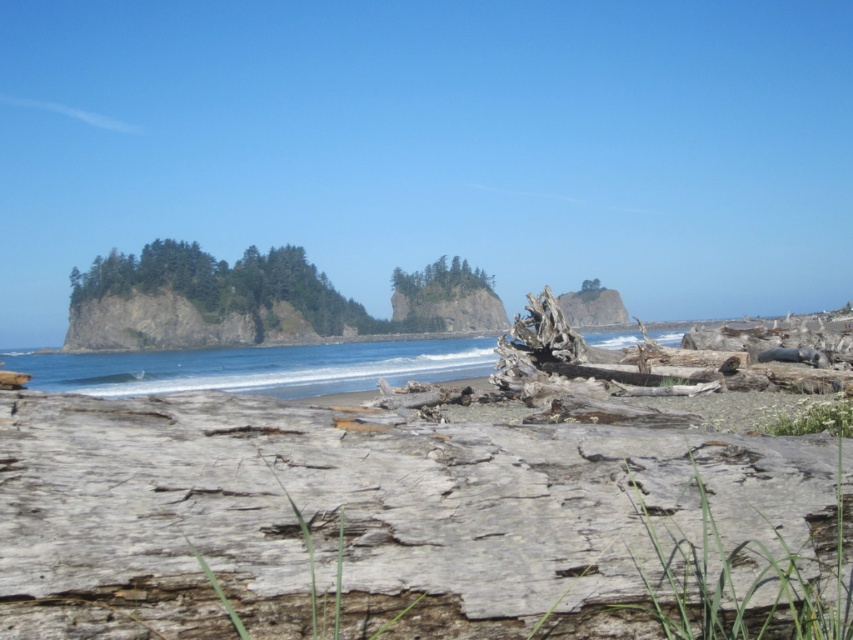
You are standing on the beach looking at the coastal landscape. There are two points marked in the scene, one at coordinates point (x=181, y=321) and the other at point (x=405, y=272). Which point is nearer to you?

Point (x=181, y=321) is closer to the viewer than point (x=405, y=272).

You are standing on the beach and want to take a photo of both the green rough rock island at left and the green textured trees at center. Which object should you zoom in on first to ensure both fit in the frame?

Since the green rough rock island at left is bigger than the green textured trees at center, you should zoom in on the green textured trees at center first to ensure both fit in the frame.

You are standing on the beach and want to walk to the green rough rock island at left. The distance between you and the island is 96.04 meters. If you walk at a speed of 1.5 meters per second, how many seconds will it take you to reach the island?

The distance between you and the green rough rock island at left is 96.04 meters. At a walking speed of 1.5 meters per second, it will take approximately 64.03 seconds to reach the island.